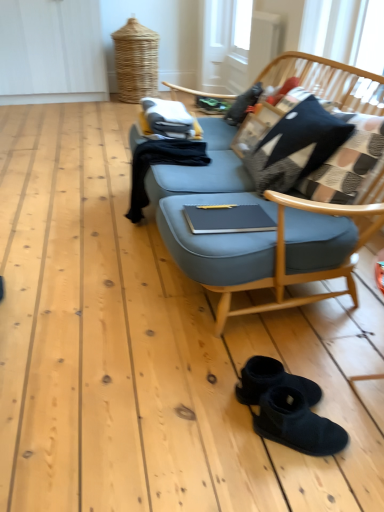
Measure the distance between plaid fabric pillow at upper right and camera.

The distance of plaid fabric pillow at upper right from camera is 1.63 meters.

This screenshot has height=512, width=384. What are the coordinates of `plaid fabric pillow at upper right` in the screenshot? It's located at (295, 145).

Describe the element at coordinates (295, 145) in the screenshot. I see `plaid fabric pillow at upper right` at that location.

The width and height of the screenshot is (384, 512). I want to click on black suede boots at lower center, so point(271,381).

The width and height of the screenshot is (384, 512). What do you see at coordinates (271, 381) in the screenshot?
I see `black suede boots at lower center` at bounding box center [271, 381].

What is the approximate width of black suede boots at lower center?

black suede boots at lower center is 10.92 inches wide.

The height and width of the screenshot is (512, 384). I want to click on plaid fabric pillow at upper right, so click(295, 145).

Based on the photo, considering the positions of objects black suede boots at lower center and plaid fabric pillow at upper right in the image provided, who is more to the left, black suede boots at lower center or plaid fabric pillow at upper right?

black suede boots at lower center.

Is black suede boots at lower center closer to the viewer compared to plaid fabric pillow at upper right?

Yes, the depth of black suede boots at lower center is less than that of plaid fabric pillow at upper right.

Consider the image. Which is nearer, [258,371] or [311,142]?

Point [258,371].

From the image's perspective, is black suede boots at lower center located above or below plaid fabric pillow at upper right?

Clearly, from the image's perspective, black suede boots at lower center is below plaid fabric pillow at upper right.

From a real-world perspective, does black suede boots at lower center sit lower than plaid fabric pillow at upper right?

Yes, from a real-world perspective, black suede boots at lower center is under plaid fabric pillow at upper right.

Is black suede boots at lower center thinner than plaid fabric pillow at upper right?

No.

Who is taller, black suede boots at lower center or plaid fabric pillow at upper right?

With more height is plaid fabric pillow at upper right.

Which of these two, black suede boots at lower center or plaid fabric pillow at upper right, is smaller?

With smaller size is black suede boots at lower center.

Is plaid fabric pillow at upper right inside black suede boots at lower center?

Actually, plaid fabric pillow at upper right is outside black suede boots at lower center.

Is black suede boots at lower center with plaid fabric pillow at upper right?

No.

Is black suede boots at lower center turned away from plaid fabric pillow at upper right?

No, plaid fabric pillow at upper right is not at the back of black suede boots at lower center.

How distant is black suede boots at lower center from plaid fabric pillow at upper right?

They are 36.07 inches apart.

Locate an element on the screen. The height and width of the screenshot is (512, 384). footwear on the left side of plaid fabric pillow at upper right is located at coordinates (271, 381).

Considering the relative positions of plaid fabric pillow at upper right and black suede boots at lower center in the image provided, is plaid fabric pillow at upper right to the left of black suede boots at lower center from the viewer's perspective?

Incorrect, plaid fabric pillow at upper right is not on the left side of black suede boots at lower center.

Which object is further away from the camera, plaid fabric pillow at upper right or black suede boots at lower center?

plaid fabric pillow at upper right is behind.

Does point (318, 126) appear closer or farther from the camera than point (271, 370)?

Point (318, 126) is positioned farther from the camera compared to point (271, 370).

From the image's perspective, would you say plaid fabric pillow at upper right is positioned over black suede boots at lower center?

Indeed, from the image's perspective, plaid fabric pillow at upper right is shown above black suede boots at lower center.

Based on the photo, from a real-world perspective, is plaid fabric pillow at upper right on black suede boots at lower center?

Yes, from a real-world perspective, plaid fabric pillow at upper right is above black suede boots at lower center.

Between plaid fabric pillow at upper right and black suede boots at lower center, which one has larger width?

black suede boots at lower center is wider.

Can you confirm if plaid fabric pillow at upper right is shorter than black suede boots at lower center?

Incorrect, the height of plaid fabric pillow at upper right does not fall short of that of black suede boots at lower center.

Between plaid fabric pillow at upper right and black suede boots at lower center, which one has smaller size?

black suede boots at lower center.

Is plaid fabric pillow at upper right not inside black suede boots at lower center?

Yes, plaid fabric pillow at upper right is located beyond the bounds of black suede boots at lower center.

Is plaid fabric pillow at upper right next to black suede boots at lower center?

There is a gap between plaid fabric pillow at upper right and black suede boots at lower center.

Does plaid fabric pillow at upper right turn towards black suede boots at lower center?

No, plaid fabric pillow at upper right is not aimed at black suede boots at lower center.

How many degrees apart are the facing directions of plaid fabric pillow at upper right and black suede boots at lower center?

The angle between the facing direction of plaid fabric pillow at upper right and the facing direction of black suede boots at lower center is 179 degrees.

How far apart are plaid fabric pillow at upper right and black suede boots at lower center?

A distance of 91.61 centimeters exists between plaid fabric pillow at upper right and black suede boots at lower center.

This screenshot has height=512, width=384. Identify the location of pillow behind the black suede boots at lower center. (295, 145).

The width and height of the screenshot is (384, 512). I want to click on pillow above the black suede boots at lower center (from a real-world perspective), so click(x=295, y=145).

The width and height of the screenshot is (384, 512). Identify the location of footwear on the left of plaid fabric pillow at upper right. (271, 381).